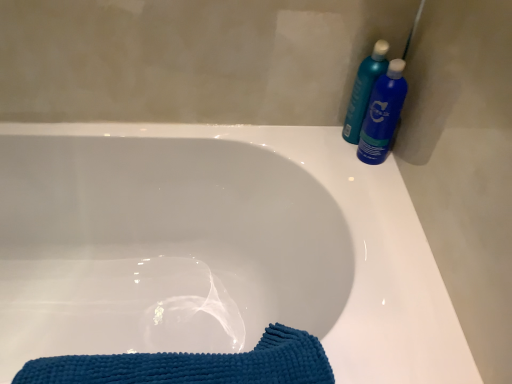
Describe the element at coordinates (194, 365) in the screenshot. I see `blue textured towel at lower left` at that location.

At what (x,y) coordinates should I click in order to perform the action: click on teal plastic bottles at upper right, which appears as the 2th cleaning product when viewed from the right. Please return your answer as a coordinate pair (x, y). Looking at the image, I should click on (364, 90).

This screenshot has height=384, width=512. I want to click on blue textured towel at lower left, so click(x=194, y=365).

Is blue glossy bottle at upper right, arranged as the second cleaning product when viewed from the left, oriented away from blue textured towel at lower left?

blue glossy bottle at upper right, arranged as the second cleaning product when viewed from the left, does not have its back to blue textured towel at lower left.

Is blue glossy bottle at upper right, which ranks as the 1th cleaning product in right-to-left order, wider than blue textured towel at lower left?

In fact, blue glossy bottle at upper right, which ranks as the 1th cleaning product in right-to-left order, might be narrower than blue textured towel at lower left.

Would you say blue textured towel at lower left is part of blue glossy bottle at upper right, which ranks as the 1th cleaning product in right-to-left order,'s contents?

No, blue textured towel at lower left is not a part of blue glossy bottle at upper right, which ranks as the 1th cleaning product in right-to-left order.

Which object is more forward, blue glossy bottle at upper right, arranged as the second cleaning product when viewed from the left, or blue textured towel at lower left?

blue textured towel at lower left is closer to the camera.

Is blue glossy bottle at upper right, which ranks as the 1th cleaning product in right-to-left order, surrounded by blue textured towel at lower left?

No, blue glossy bottle at upper right, which ranks as the 1th cleaning product in right-to-left order, is not surrounded by blue textured towel at lower left.

From a real-world perspective, is blue textured towel at lower left under blue glossy bottle at upper right, which ranks as the 1th cleaning product in right-to-left order?

Indeed, from a real-world perspective, blue textured towel at lower left is positioned beneath blue glossy bottle at upper right, which ranks as the 1th cleaning product in right-to-left order.

Is blue textured towel at lower left looking in the opposite direction of blue glossy bottle at upper right, which ranks as the 1th cleaning product in right-to-left order?

No, blue textured towel at lower left's orientation is not away from blue glossy bottle at upper right, which ranks as the 1th cleaning product in right-to-left order.

Is point (360, 349) farther from camera compared to point (392, 114)?

No.

What's the angular difference between white glossy bathtub at center and blue glossy bottle at upper right, arranged as the second cleaning product when viewed from the left,'s facing directions?

2.71 degrees separate the facing orientations of white glossy bathtub at center and blue glossy bottle at upper right, arranged as the second cleaning product when viewed from the left.

Locate an element on the screen. The width and height of the screenshot is (512, 384). bathtub below the blue glossy bottle at upper right, which ranks as the 1th cleaning product in right-to-left order (from the image's perspective) is located at coordinates (354, 250).

Can you confirm if white glossy bathtub at center is taller than blue glossy bottle at upper right, arranged as the second cleaning product when viewed from the left?

Correct, white glossy bathtub at center is much taller as blue glossy bottle at upper right, arranged as the second cleaning product when viewed from the left.

From a real-world perspective, relative to white glossy bathtub at center, is teal plastic bottles at upper right, which is the first cleaning product in left-to-right order, vertically above or below?

In terms of real-world spatial position, teal plastic bottles at upper right, which is the first cleaning product in left-to-right order, is above white glossy bathtub at center.

From the image's perspective, which one is positioned lower, teal plastic bottles at upper right, which appears as the 2th cleaning product when viewed from the right, or white glossy bathtub at center?

white glossy bathtub at center.

Considering the relative sizes of teal plastic bottles at upper right, which appears as the 2th cleaning product when viewed from the right, and white glossy bathtub at center in the image provided, is teal plastic bottles at upper right, which appears as the 2th cleaning product when viewed from the right, shorter than white glossy bathtub at center?

Yes, teal plastic bottles at upper right, which appears as the 2th cleaning product when viewed from the right, is shorter than white glossy bathtub at center.

Is the depth of teal plastic bottles at upper right, which is the first cleaning product in left-to-right order, less than that of white glossy bathtub at center?

No, teal plastic bottles at upper right, which is the first cleaning product in left-to-right order, is further to the viewer.

From a real-world perspective, is teal plastic bottles at upper right, which appears as the 2th cleaning product when viewed from the right, physically located above or below blue glossy bottle at upper right, which ranks as the 1th cleaning product in right-to-left order?

teal plastic bottles at upper right, which appears as the 2th cleaning product when viewed from the right, is situated higher than blue glossy bottle at upper right, which ranks as the 1th cleaning product in right-to-left order, in the real world.

In the scene shown: Who is bigger, teal plastic bottles at upper right, which appears as the 2th cleaning product when viewed from the right, or blue glossy bottle at upper right, which ranks as the 1th cleaning product in right-to-left order?

blue glossy bottle at upper right, which ranks as the 1th cleaning product in right-to-left order, is bigger.

Consider the image. Is blue glossy bottle at upper right, which ranks as the 1th cleaning product in right-to-left order, far away from teal plastic bottles at upper right, which is the first cleaning product in left-to-right order?

No, blue glossy bottle at upper right, which ranks as the 1th cleaning product in right-to-left order, is in close proximity to teal plastic bottles at upper right, which is the first cleaning product in left-to-right order.

Which of these two, blue glossy bottle at upper right, which ranks as the 1th cleaning product in right-to-left order, or teal plastic bottles at upper right, which appears as the 2th cleaning product when viewed from the right, is thinner?

Thinner between the two is teal plastic bottles at upper right, which appears as the 2th cleaning product when viewed from the right.

Is blue glossy bottle at upper right, which ranks as the 1th cleaning product in right-to-left order, aimed at teal plastic bottles at upper right, which appears as the 2th cleaning product when viewed from the right?

No, blue glossy bottle at upper right, which ranks as the 1th cleaning product in right-to-left order, is not aimed at teal plastic bottles at upper right, which appears as the 2th cleaning product when viewed from the right.

Is white glossy bathtub at center shorter than blue textured towel at lower left?

Incorrect, the height of white glossy bathtub at center does not fall short of that of blue textured towel at lower left.

Who is bigger, white glossy bathtub at center or blue textured towel at lower left?

white glossy bathtub at center.

Is white glossy bathtub at center not inside blue textured towel at lower left?

Yes, white glossy bathtub at center is outside of blue textured towel at lower left.

Consider the image. Does white glossy bathtub at center come behind blue textured towel at lower left?

That is False.

Locate an element on the screen. the 1st cleaning product above the blue textured towel at lower left (from the image's perspective) is located at coordinates pyautogui.click(x=382, y=114).

Where is `beach towel that is below the blue glossy bottle at upper right, which ranks as the 1th cleaning product in right-to-left order (from the image's perspective)`? Image resolution: width=512 pixels, height=384 pixels. beach towel that is below the blue glossy bottle at upper right, which ranks as the 1th cleaning product in right-to-left order (from the image's perspective) is located at coordinates (194, 365).

When comparing their distances from white glossy bathtub at center, does blue textured towel at lower left or blue glossy bottle at upper right, which ranks as the 1th cleaning product in right-to-left order, seem closer?

Among the two, blue glossy bottle at upper right, which ranks as the 1th cleaning product in right-to-left order, is located nearer to white glossy bathtub at center.

Consider the image. Which object lies further to the anchor point white glossy bathtub at center, teal plastic bottles at upper right, which appears as the 2th cleaning product when viewed from the right, or blue textured towel at lower left?

Among the two, teal plastic bottles at upper right, which appears as the 2th cleaning product when viewed from the right, is located further to white glossy bathtub at center.

When comparing their distances from blue textured towel at lower left, does blue glossy bottle at upper right, which ranks as the 1th cleaning product in right-to-left order, or teal plastic bottles at upper right, which appears as the 2th cleaning product when viewed from the right, seem further?

teal plastic bottles at upper right, which appears as the 2th cleaning product when viewed from the right, is positioned further to the anchor blue textured towel at lower left.

Which object lies further to the anchor point blue textured towel at lower left, white glossy bathtub at center or blue glossy bottle at upper right, which ranks as the 1th cleaning product in right-to-left order?

Based on the image, blue glossy bottle at upper right, which ranks as the 1th cleaning product in right-to-left order, appears to be further to blue textured towel at lower left.

Looking at the image, which one is located closer to white glossy bathtub at center, blue textured towel at lower left or teal plastic bottles at upper right, which is the first cleaning product in left-to-right order?

blue textured towel at lower left lies closer to white glossy bathtub at center than the other object.

Which object lies further to the anchor point teal plastic bottles at upper right, which is the first cleaning product in left-to-right order, blue textured towel at lower left or blue glossy bottle at upper right, arranged as the second cleaning product when viewed from the left?

Among the two, blue textured towel at lower left is located further to teal plastic bottles at upper right, which is the first cleaning product in left-to-right order.

Estimate the real-world distances between objects in this image. Which object is closer to blue glossy bottle at upper right, arranged as the second cleaning product when viewed from the left, teal plastic bottles at upper right, which appears as the 2th cleaning product when viewed from the right, or blue textured towel at lower left?

The object closer to blue glossy bottle at upper right, arranged as the second cleaning product when viewed from the left, is teal plastic bottles at upper right, which appears as the 2th cleaning product when viewed from the right.

Which object lies nearer to the anchor point blue glossy bottle at upper right, which ranks as the 1th cleaning product in right-to-left order, blue textured towel at lower left or white glossy bathtub at center?

Based on the image, white glossy bathtub at center appears to be nearer to blue glossy bottle at upper right, which ranks as the 1th cleaning product in right-to-left order.

The image size is (512, 384). What are the coordinates of `cleaning product between teal plastic bottles at upper right, which appears as the 2th cleaning product when viewed from the right, and blue textured towel at lower left from top to bottom` in the screenshot? It's located at (382, 114).

I want to click on bathtub that lies between teal plastic bottles at upper right, which is the first cleaning product in left-to-right order, and blue textured towel at lower left from top to bottom, so click(354, 250).

The height and width of the screenshot is (384, 512). Identify the location of cleaning product located between white glossy bathtub at center and blue glossy bottle at upper right, arranged as the second cleaning product when viewed from the left, in the left-right direction. (364, 90).

The width and height of the screenshot is (512, 384). In order to click on beach towel located between white glossy bathtub at center and blue glossy bottle at upper right, which ranks as the 1th cleaning product in right-to-left order, in the left-right direction in this screenshot , I will do `click(194, 365)`.